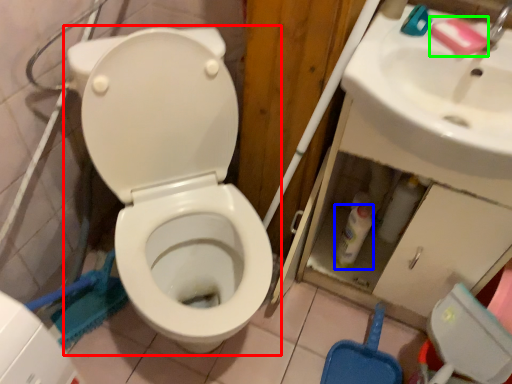
Question: Which object is positioned farthest from toilet (highlighted by a red box)? Select from bottle (highlighted by a blue box) and soap (highlighted by a green box).

Choices:
 (A) bottle
 (B) soap

Answer: (B)